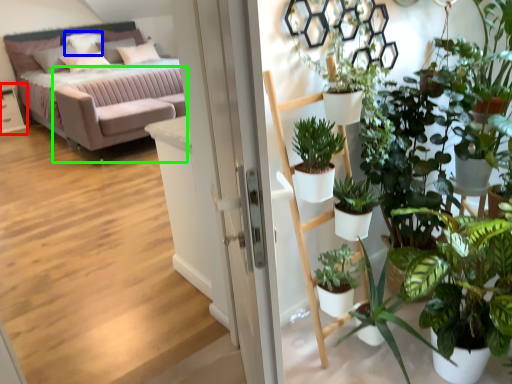
Question: Based on their relative distances, which object is nearer to table (highlighted by a red box)? Choose from pillow (highlighted by a blue box) and couch (highlighted by a green box).

Choices:
 (A) pillow
 (B) couch

Answer: (A)